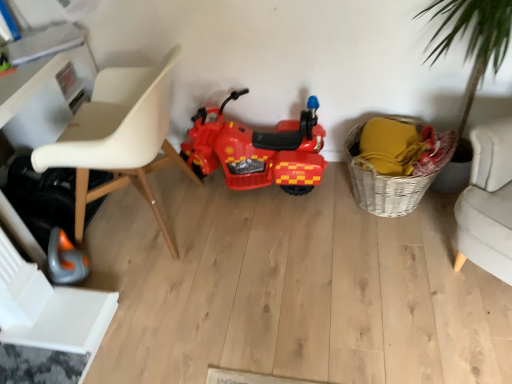
At what (x,y) coordinates should I click in order to perform the action: click on vacant area that lies between white plastic chair at left and shiny plastic motorcycle at center. Please return your answer as a coordinate pair (x, y). Looking at the image, I should click on (244, 214).